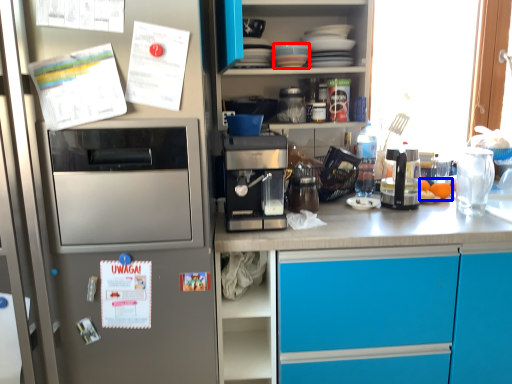
Question: Which of the following is the farthest to the observer, appliance (highlighted by a red box) or food (highlighted by a blue box)?

Choices:
 (A) appliance
 (B) food

Answer: (B)